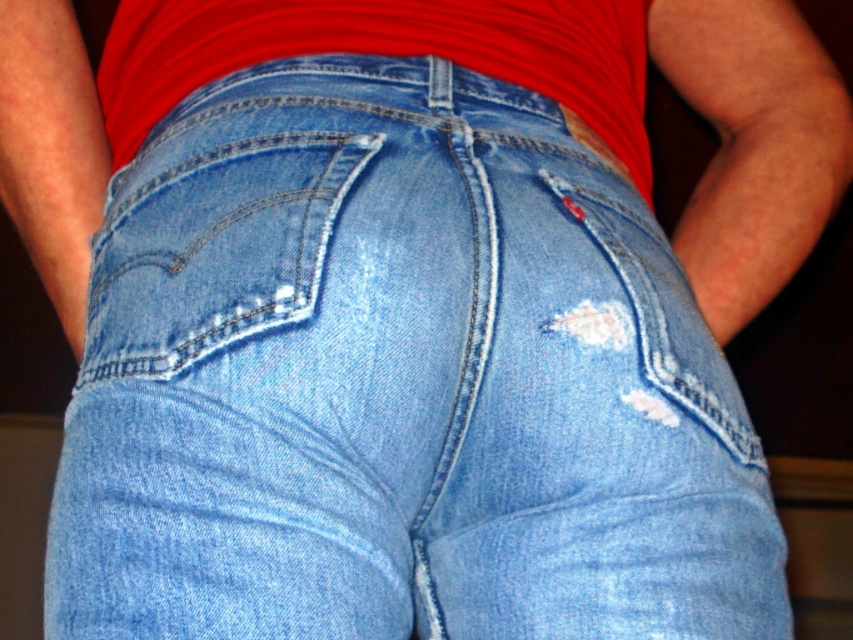
Question: Does light blue denim pocket at center come behind red cotton shirt at center?

Choices:
 (A) no
 (B) yes

Answer: (A)

Question: Which point is farther to the camera?

Choices:
 (A) (339, 204)
 (B) (624, 72)

Answer: (B)

Question: Which object is farther from the camera taking this photo?

Choices:
 (A) light blue denim pocket at center
 (B) red cotton shirt at center

Answer: (B)

Question: Among these points, which one is farthest from the camera?

Choices:
 (A) (140, 186)
 (B) (112, 77)

Answer: (B)

Question: Is light blue denim pocket at center positioned behind red cotton shirt at center?

Choices:
 (A) yes
 (B) no

Answer: (B)

Question: Does light blue denim pocket at center appear on the right side of red cotton shirt at center?

Choices:
 (A) no
 (B) yes

Answer: (A)